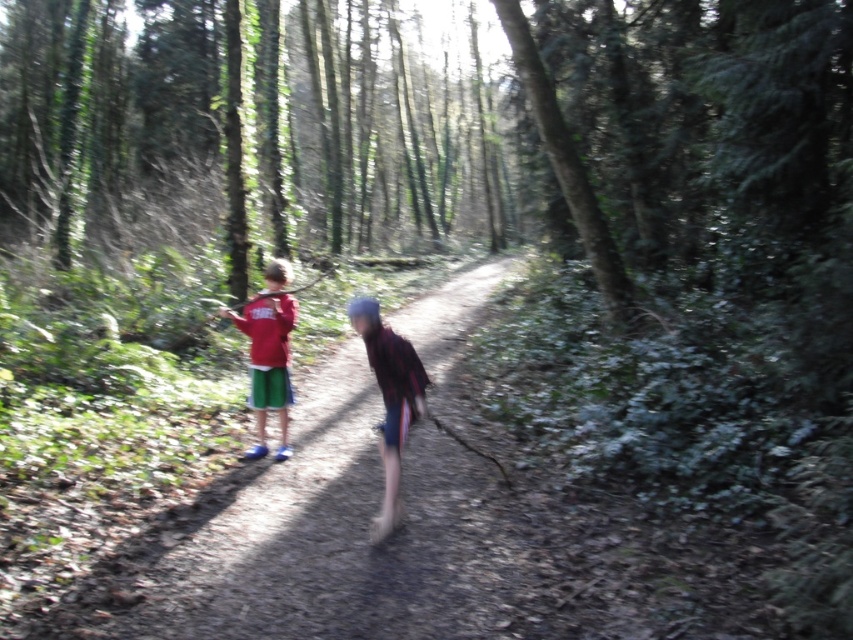
Which is more to the left, green leafy tree at center or plaid fabric shirt at center?

Positioned to the left is plaid fabric shirt at center.

Which is in front, point (590, 257) or point (376, 307)?

Point (376, 307)

Is point (515, 13) farther from camera compared to point (399, 454)?

Yes.

This screenshot has width=853, height=640. What are the coordinates of `green leafy tree at center` in the screenshot? It's located at (567, 168).

Is point (376, 541) positioned after point (252, 355)?

No, it is in front of (252, 355).

Which is in front, point (355, 330) or point (262, 420)?

Positioned in front is point (262, 420).

Locate an element on the screen. This screenshot has width=853, height=640. plaid fabric shirt at center is located at coordinates (389, 400).

Who is higher up, green leafy tree at center or matte red shirt at left?

Positioned higher is green leafy tree at center.

In the scene shown: Which is more to the right, green leafy tree at center or matte red shirt at left?

Positioned to the right is green leafy tree at center.

Find the location of a particular element. Image resolution: width=853 pixels, height=640 pixels. green leafy tree at center is located at coordinates (567, 168).

At what (x,y) coordinates should I click in order to perform the action: click on green leafy tree at center. Please return your answer as a coordinate pair (x, y). The height and width of the screenshot is (640, 853). Looking at the image, I should click on (567, 168).